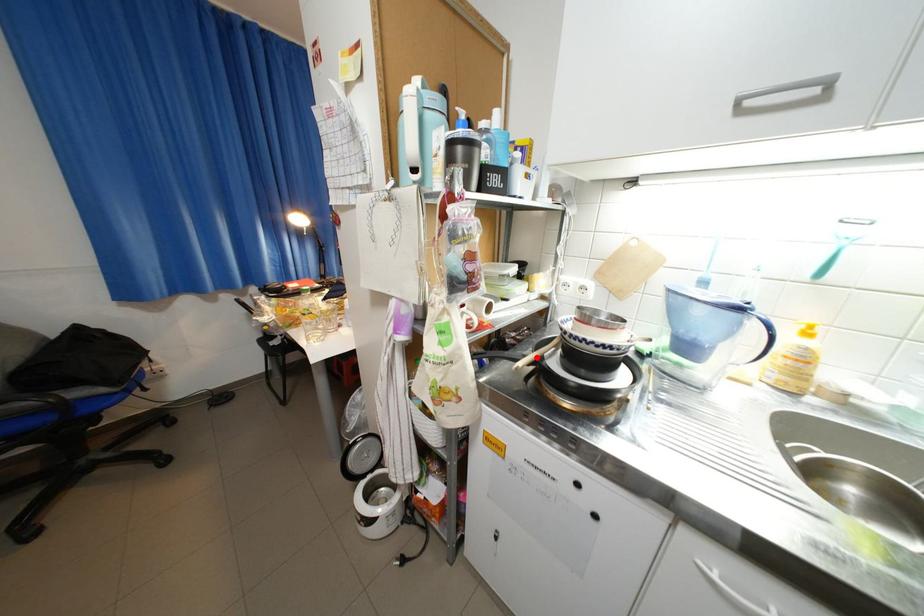
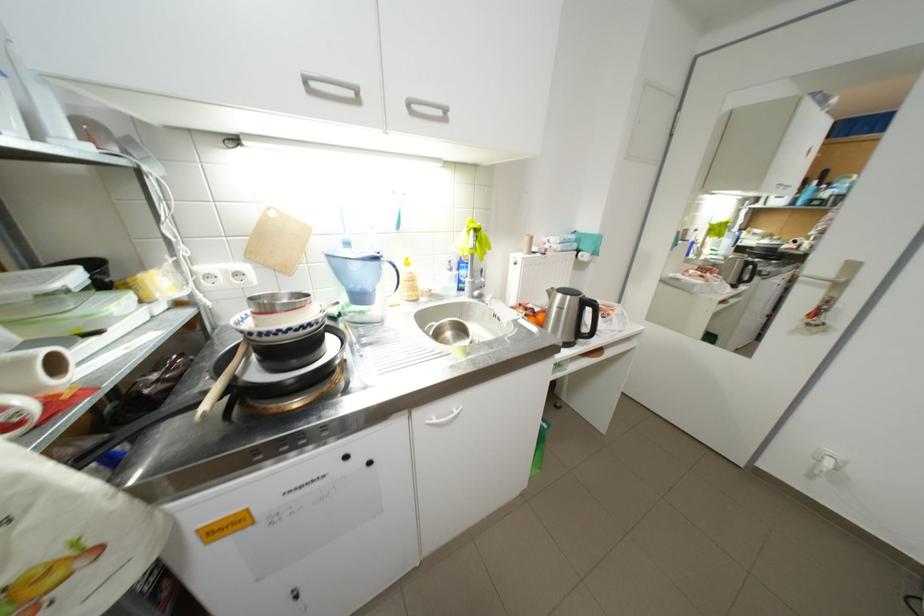
Question: I am providing you with two images of the same scene from different viewpoints. Given a red point in image1, look at the same physical point in image2. Is it:

Choices:
 (A) Closer to the viewpoint
 (B) Farther from the viewpoint

Answer: (B)